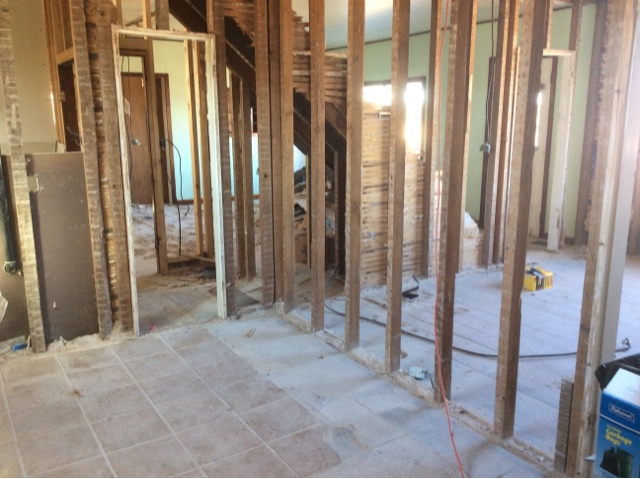
Image resolution: width=640 pixels, height=479 pixels. Identify the location of finished floors and ceiling. (372, 58), (376, 20), (173, 65).